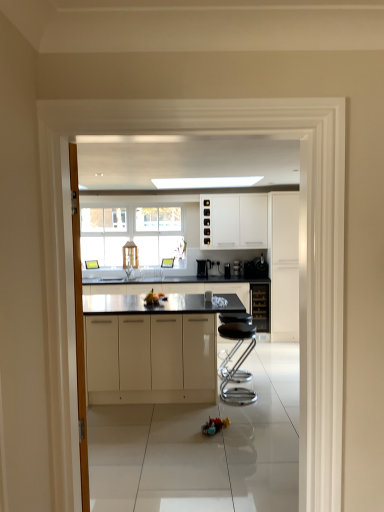
Question: In terms of width, does metallic silver bar stool at center look wider or thinner when compared to satin black coffee maker at center, arranged as the first appliance when viewed from the right?

Choices:
 (A) wide
 (B) thin

Answer: (A)

Question: From their relative heights in the image, would you say metallic silver bar stool at center is taller or shorter than satin black coffee maker at center, arranged as the first appliance when viewed from the right?

Choices:
 (A) tall
 (B) short

Answer: (A)

Question: Which object is the farthest from the white glossy cabinets at upper center, which appears as the 3th cabinetry when viewed from the right?

Choices:
 (A) satin black coffee machine at center
 (B) metallic silver bar stool at center
 (C) black glass wine cooler at center, which appears as the second cabinetry when viewed from the right
 (D) white glossy cabinet at right, which is the 4th cabinetry from left to right
 (E) satin black coffee maker at center, arranged as the first appliance when viewed from the right

Answer: (B)

Question: Which object is the closest to the glossy white cabinets at center, the 4th cabinetry when ordered from right to left?

Choices:
 (A) white glossy cabinets at upper center, which appears as the 3th cabinetry when viewed from the right
 (B) metallic silver bar stool at center
 (C) satin black coffee maker at center, the second appliance in the left-to-right sequence
 (D) black glass wine cooler at center, which appears as the second cabinetry when viewed from the right
 (E) satin black coffee maker at center, which is counted as the second appliance, starting from the right

Answer: (B)